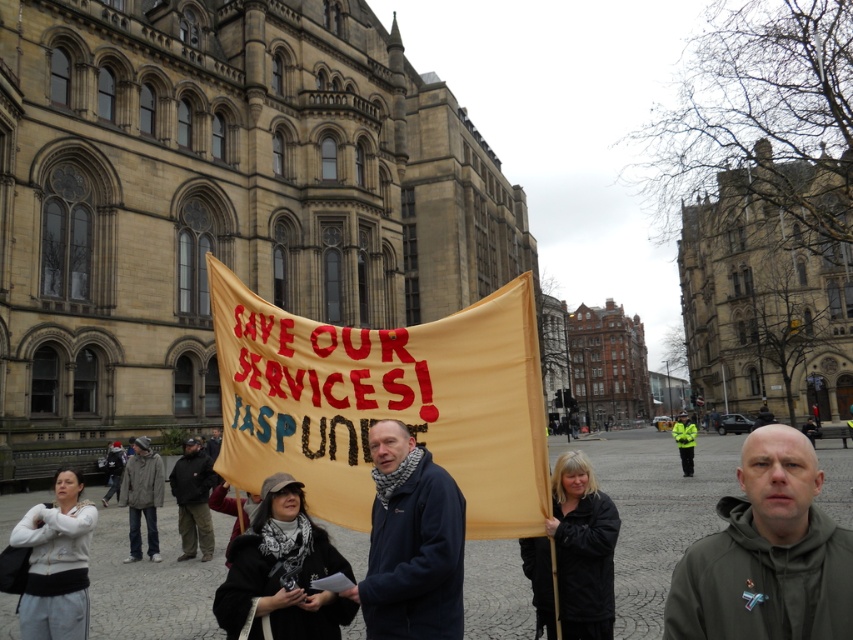
Is dark blue jacket at center above gray woolen jacket at lower left?

Correct, dark blue jacket at center is located above gray woolen jacket at lower left.

Which is more to the left, dark blue jacket at center or gray woolen jacket at lower left?

Positioned to the left is gray woolen jacket at lower left.

Describe the element at coordinates (410, 541) in the screenshot. I see `dark blue jacket at center` at that location.

Find the location of a particular element. dark blue jacket at center is located at coordinates (410, 541).

Based on the photo, between dark green hoodie at center and dark brown leather jacket at center, which one is positioned higher?

Positioned higher is dark brown leather jacket at center.

Does point (770, 470) come farther from viewer compared to point (193, 548)?

No.

This screenshot has width=853, height=640. What are the coordinates of `dark green hoodie at center` in the screenshot? It's located at (766, 554).

Can you confirm if yellow fabric banner at center is bigger than dark brown leather jacket at center?

Correct, yellow fabric banner at center is larger in size than dark brown leather jacket at center.

Does point (277, 340) come in front of point (180, 506)?

Yes, it is.

Between point (326, 474) and point (190, 464), which one is positioned behind?

The point (190, 464) is more distant.

The height and width of the screenshot is (640, 853). In order to click on yellow fabric banner at center in this screenshot , I will do `click(386, 403)`.